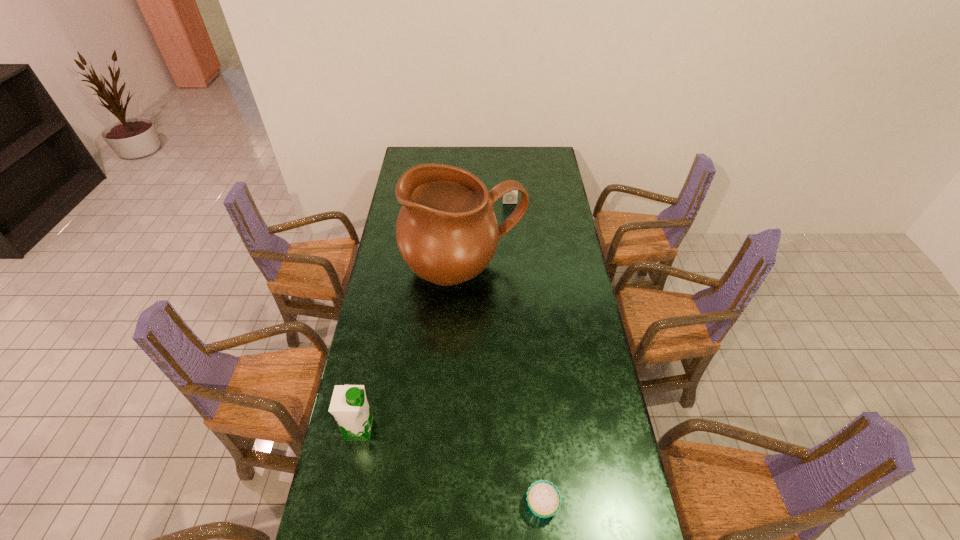
Where is `vacant space situated 0.050m on the back of the nearest object`? Image resolution: width=960 pixels, height=540 pixels. vacant space situated 0.050m on the back of the nearest object is located at coordinates pyautogui.click(x=539, y=469).

This screenshot has height=540, width=960. In order to click on cream pitcher that is at the left edge in this screenshot , I will do pyautogui.click(x=447, y=233).

The height and width of the screenshot is (540, 960). Identify the location of soya milk that is at the left edge. (349, 406).

In the image, there is a desktop. Where is `vacant space at the far edge`? This screenshot has width=960, height=540. vacant space at the far edge is located at coordinates (459, 166).

Find the location of a particular element. The width and height of the screenshot is (960, 540). free region at the right edge of the desktop is located at coordinates (573, 401).

The height and width of the screenshot is (540, 960). I want to click on blank space at the far left corner of the desktop, so click(425, 157).

Locate an element on the screen. The width and height of the screenshot is (960, 540). vacant space at the far right corner of the desktop is located at coordinates (540, 167).

The width and height of the screenshot is (960, 540). Identify the location of free space between the nearest object and the soya milk. (451, 467).

Where is `vacant point located between the nearest object and the soya milk`? This screenshot has width=960, height=540. vacant point located between the nearest object and the soya milk is located at coordinates (451, 467).

This screenshot has height=540, width=960. Identify the location of free space between the shortest object and the second tallest object. (451, 467).